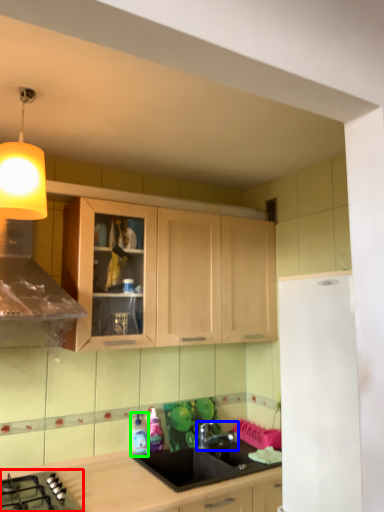
Question: Which object is the farthest from gas stove (highlighted by a red box)? Choose among these: tap (highlighted by a blue box) or bottle (highlighted by a green box).

Choices:
 (A) tap
 (B) bottle

Answer: (A)